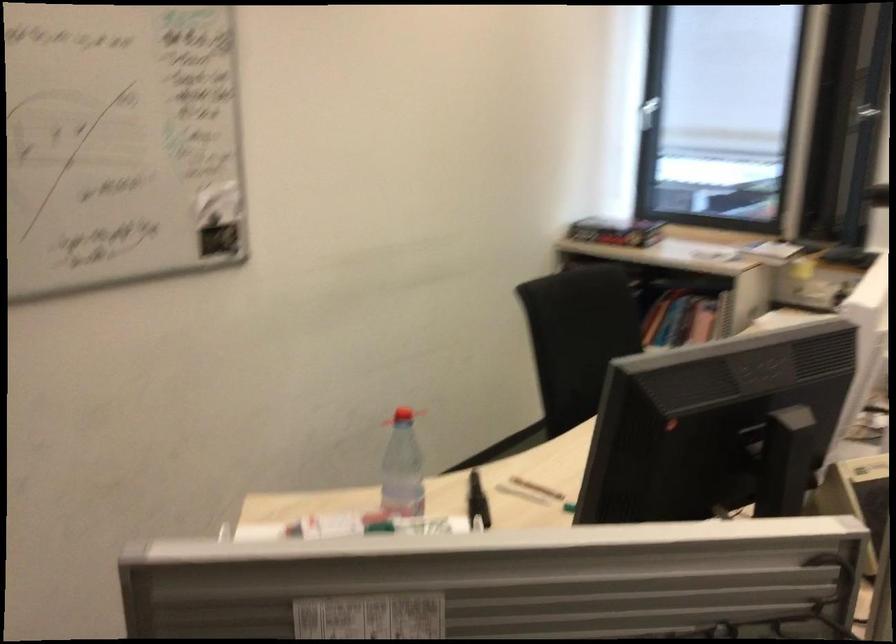
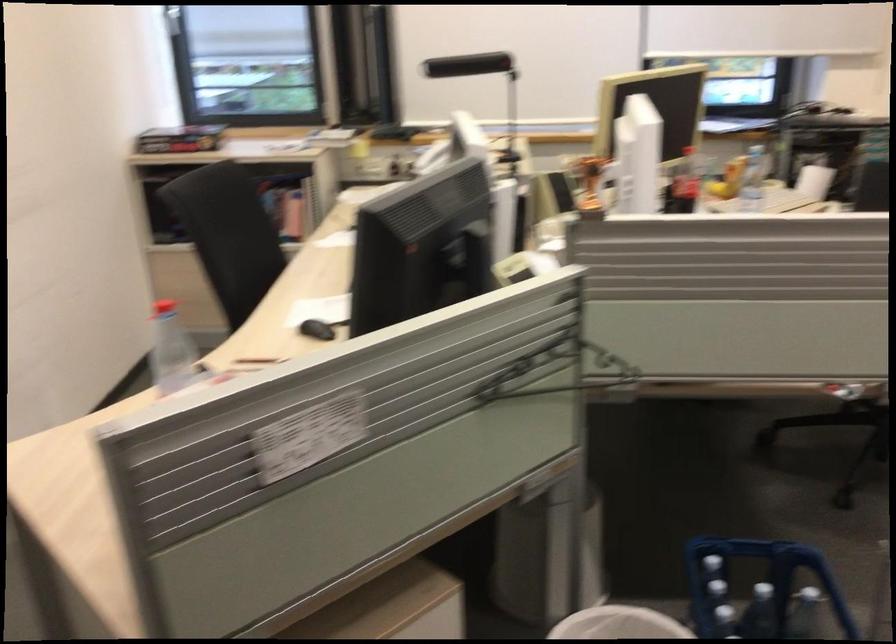
Question: How did the camera likely rotate?

Choices:
 (A) Left
 (B) Right
 (C) Up
 (D) Down

Answer: (B)